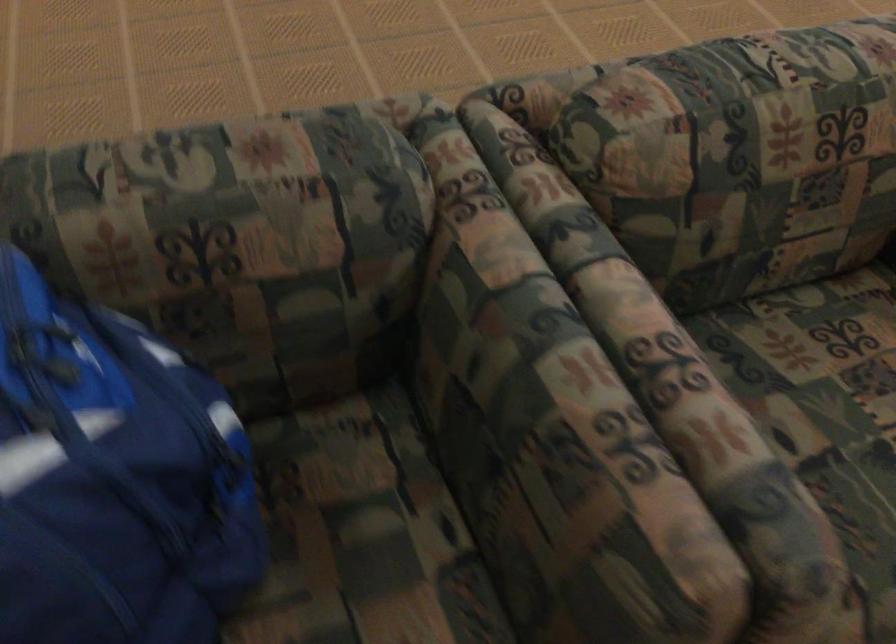
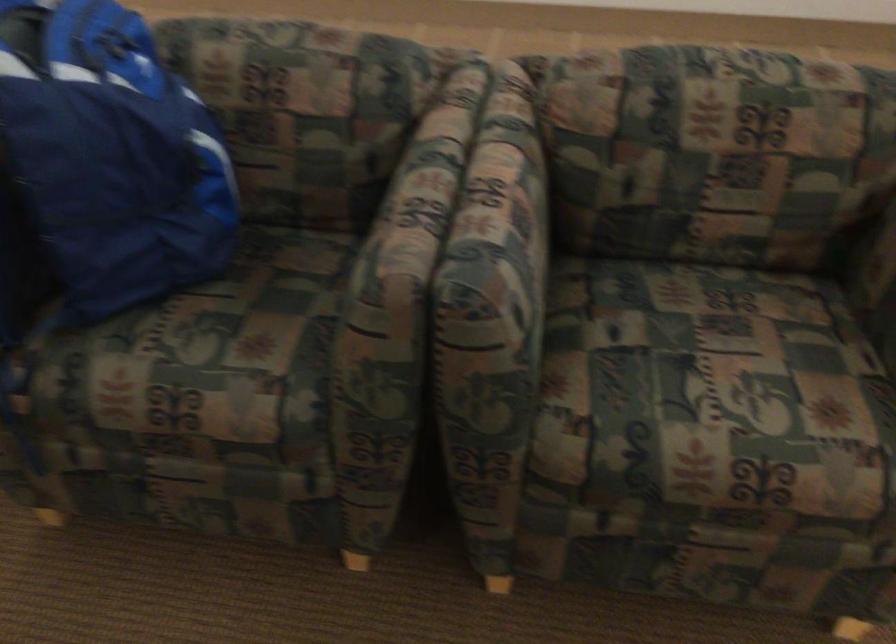
The point at [701,360] is marked in the first image. Where is the corresponding point in the second image?

(510, 196)